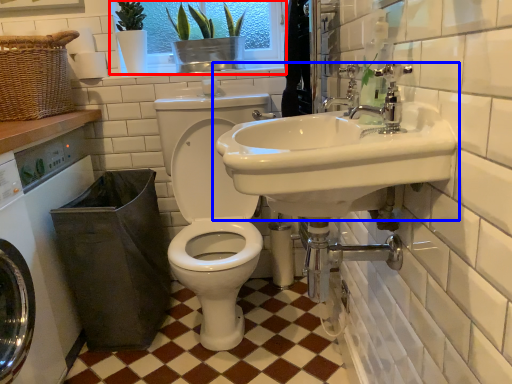
Question: Which object appears closest to the camera in this image, window screen (highlighted by a red box) or sink (highlighted by a blue box)?

Choices:
 (A) window screen
 (B) sink

Answer: (B)